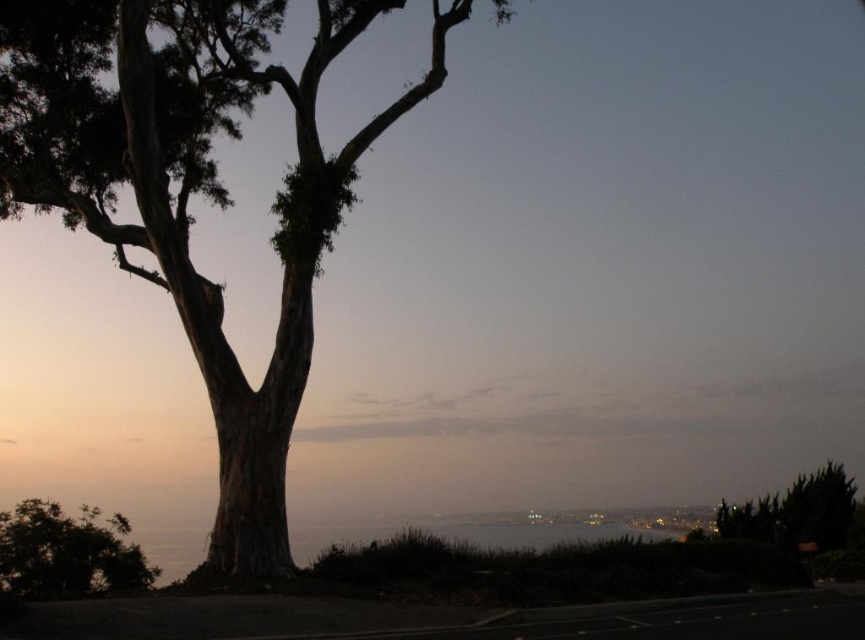
Question: Which object is farther from the camera taking this photo?

Choices:
 (A) green leafy tree at lower left
 (B) smooth bark tree at left

Answer: (B)

Question: Is smooth bark tree at left thinner than green leafy tree at lower left?

Choices:
 (A) no
 (B) yes

Answer: (B)

Question: Can you confirm if smooth bark tree at left is wider than green leafy tree at lower left?

Choices:
 (A) yes
 (B) no

Answer: (B)

Question: Which point is farther from the camera taking this photo?

Choices:
 (A) (10, 548)
 (B) (234, 88)

Answer: (B)

Question: Can you confirm if smooth bark tree at left is thinner than green leafy tree at lower left?

Choices:
 (A) yes
 (B) no

Answer: (A)